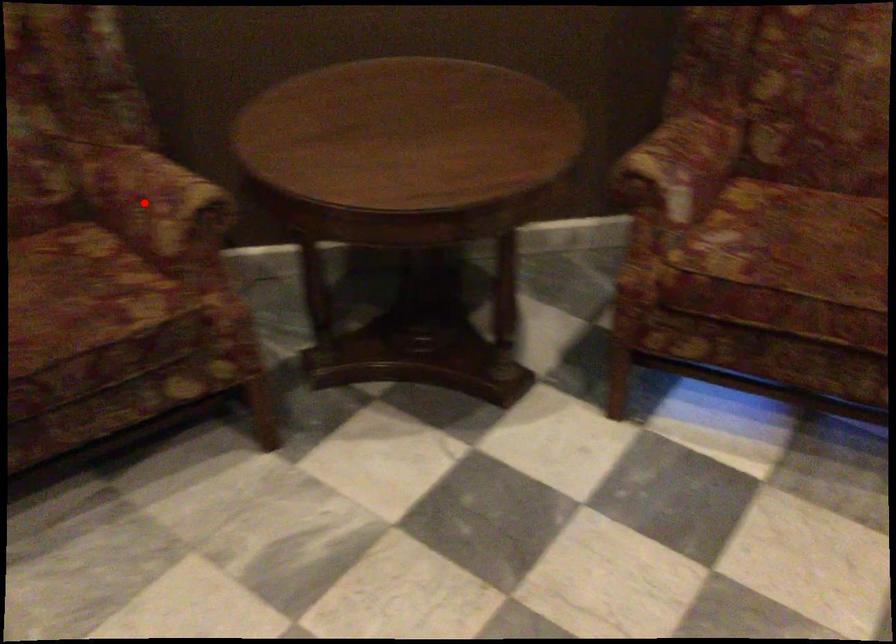
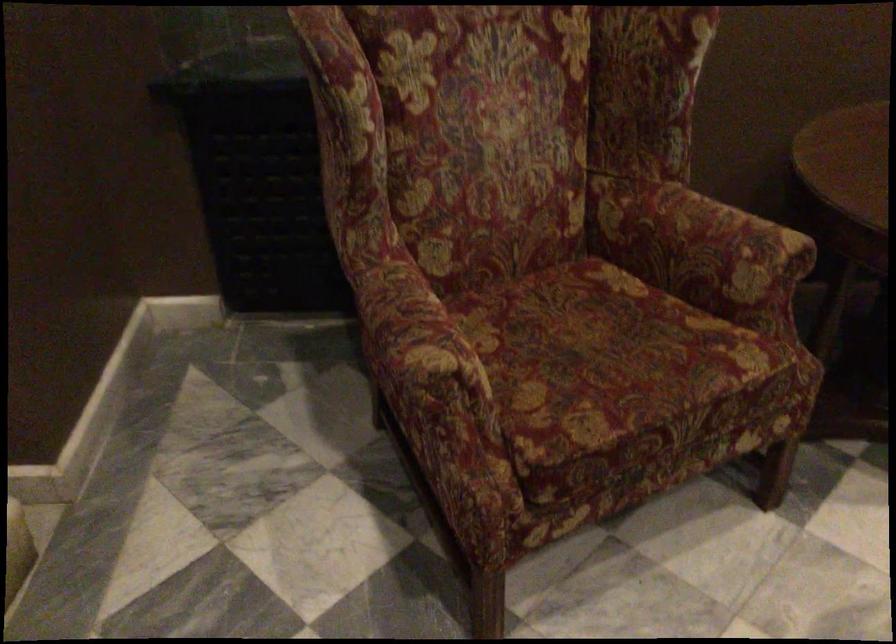
The point at the highlighted location is marked in the first image. Where is the corresponding point in the second image?

(700, 243)